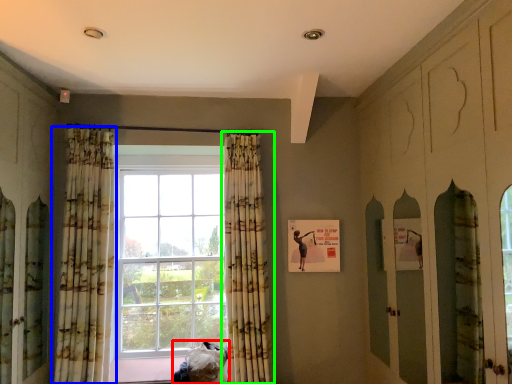
Question: Which object is the farthest from furniture (highlighted by a red box)? Choose among these: curtain (highlighted by a blue box) or curtain (highlighted by a green box).

Choices:
 (A) curtain
 (B) curtain

Answer: (A)